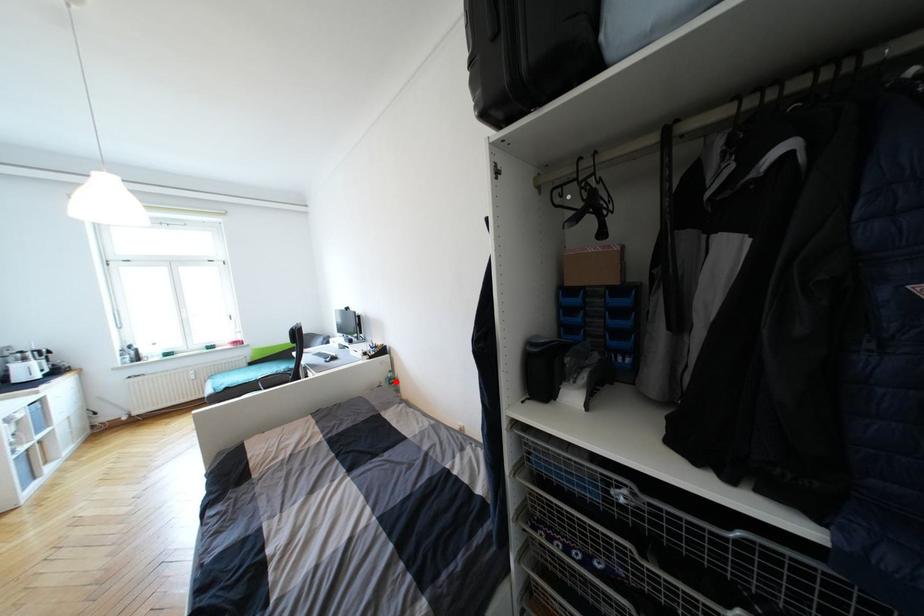
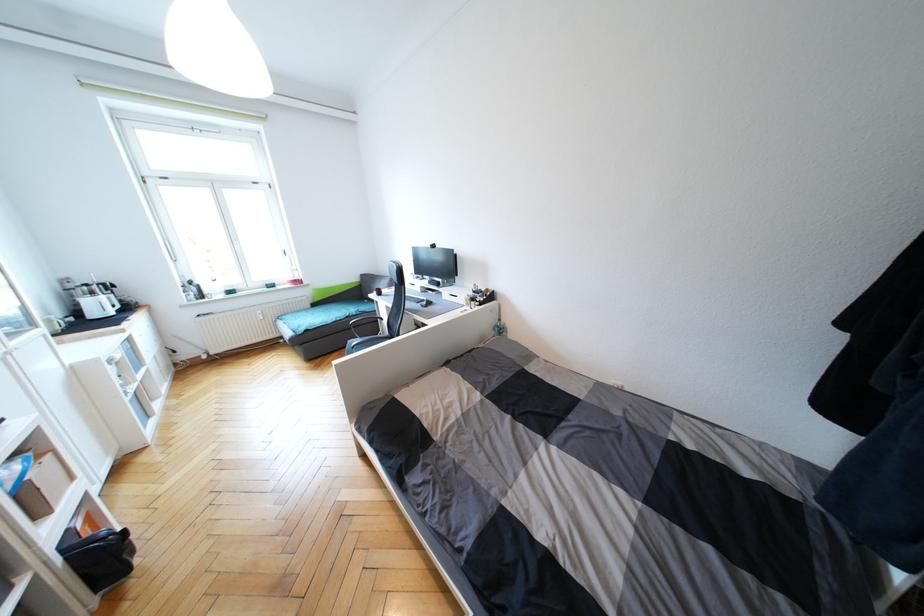
Locate, in the second image, the point that corresponds to the highlighted location in the first image.

(504, 331)